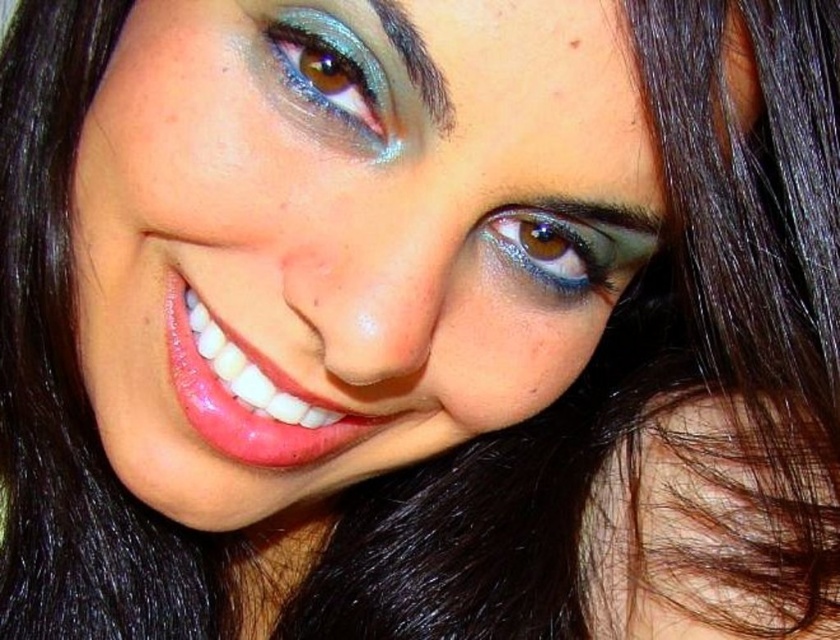
You are a GUI agent. You are given a task and a screenshot of the screen. Output one action in this format:
    pyautogui.click(x=<x>, y=<y>)
    Task: Click on the sleek dark brown eyebrow at upper center
    The width and height of the screenshot is (840, 640).
    Given the screenshot: What is the action you would take?
    pyautogui.click(x=416, y=61)

Describe the element at coordinates (416, 61) in the screenshot. I see `sleek dark brown eyebrow at upper center` at that location.

Is point (434, 99) more distant than point (571, 44)?

Yes, point (434, 99) is behind point (571, 44).

Where is `sleek dark brown eyebrow at upper center`? This screenshot has height=640, width=840. sleek dark brown eyebrow at upper center is located at coordinates (416, 61).

Describe the element at coordinates (554, 246) in the screenshot. I see `shiny brown eye at upper center` at that location.

Which is more to the right, shiny brown eye at upper center or sleek dark brown eyebrow at upper center?

From the viewer's perspective, shiny brown eye at upper center appears more on the right side.

At what (x,y) coordinates should I click in order to perform the action: click on shiny brown eye at upper center. Please return your answer as a coordinate pair (x, y). Looking at the image, I should click on (554, 246).

Is the position of shiny teal eyeshadow at upper center less distant than that of brown matte freckle at upper center?

No, it is behind brown matte freckle at upper center.

From the picture: Does shiny teal eyeshadow at upper center have a lesser width compared to brown matte freckle at upper center?

In fact, shiny teal eyeshadow at upper center might be wider than brown matte freckle at upper center.

Is point (279, 56) positioned after point (578, 45)?

Yes, it is behind point (578, 45).

This screenshot has height=640, width=840. I want to click on shiny teal eyeshadow at upper center, so click(x=332, y=74).